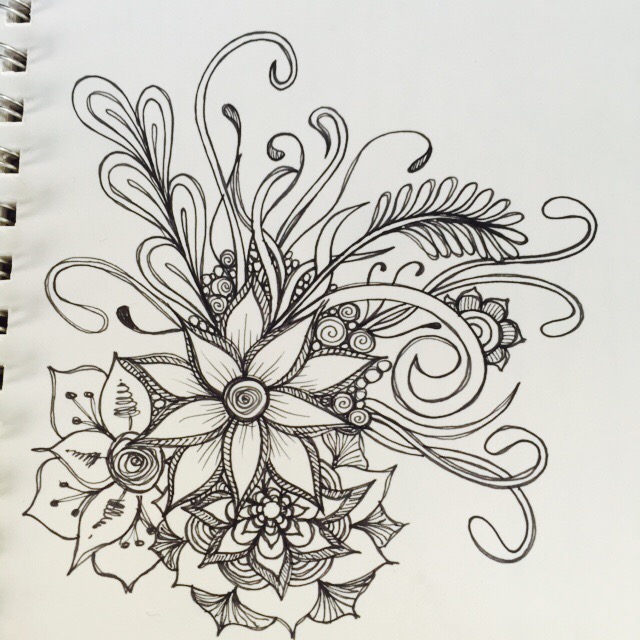
I want to click on receptacle, so click(243, 417).